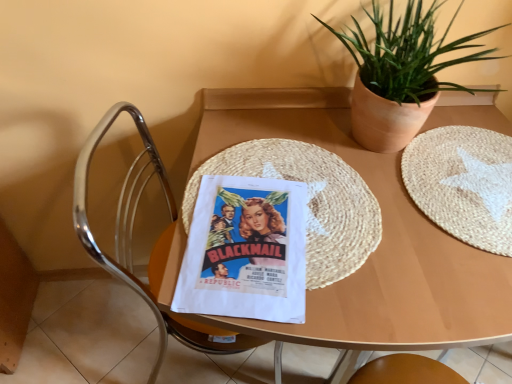
Locate an element on the screen. vacant space situated on the left part of polished chrome chair at left is located at coordinates (99, 333).